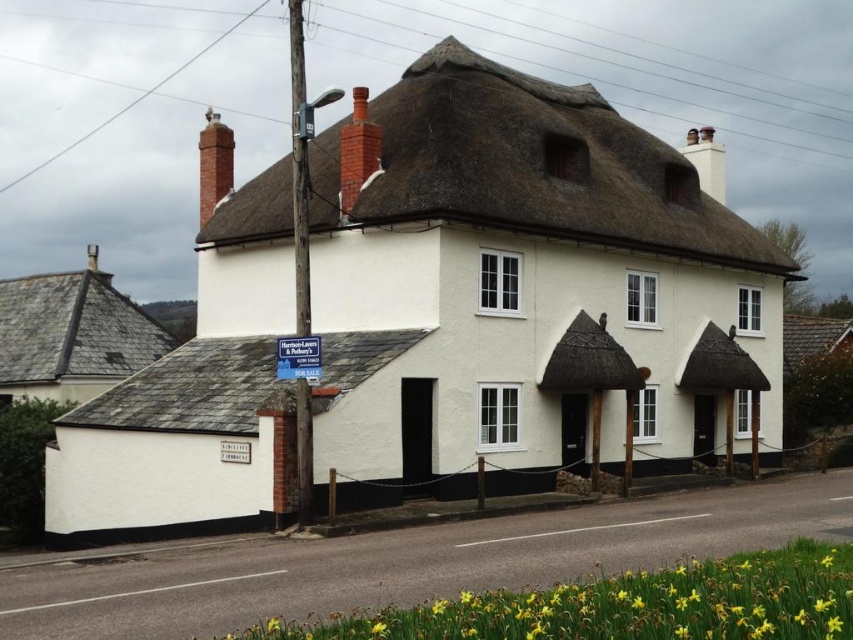
Question: Is thatched roof at upper center below gray slate roof at lower left?

Choices:
 (A) no
 (B) yes

Answer: (A)

Question: Which object is positioned closest to the brick chimney at upper center?

Choices:
 (A) thatched roof at upper center
 (B) gray slate roof at upper left

Answer: (A)

Question: Among these objects, which one is farthest from the camera?

Choices:
 (A) thatched roof at upper center
 (B) red brick chimney at upper left
 (C) gray slate roof at lower left
 (D) white thatched roof cottage at center

Answer: (B)

Question: Does white thatched roof cottage at center appear over gray slate roof at lower left?

Choices:
 (A) no
 (B) yes

Answer: (B)

Question: Among these objects, which one is farthest from the camera?

Choices:
 (A) yellow matte daffodil at lower right
 (B) gray slate roof at upper left
 (C) white thatched roof cottage at center
 (D) thatched roof at upper center

Answer: (B)

Question: Can you confirm if thatched roof at upper center is smaller than red brick chimney at upper left?

Choices:
 (A) yes
 (B) no

Answer: (A)